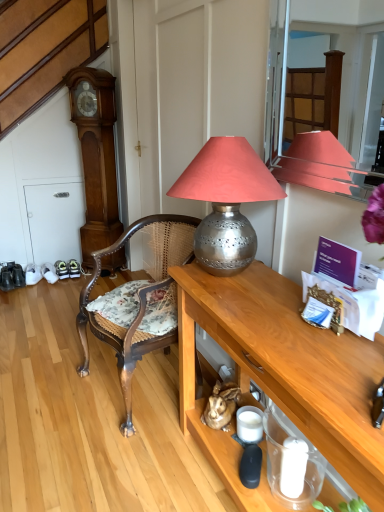
Find the location of a particular element. The image size is (384, 512). vacant space in front of woven cane chair at center is located at coordinates (107, 462).